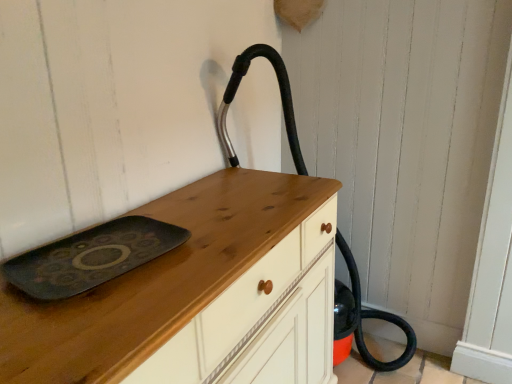
At what (x,y) coordinates should I click in order to perform the action: click on vacant area that lies in front of matte black tray at center. Please return your answer as a coordinate pair (x, y). Looking at the image, I should click on (86, 328).